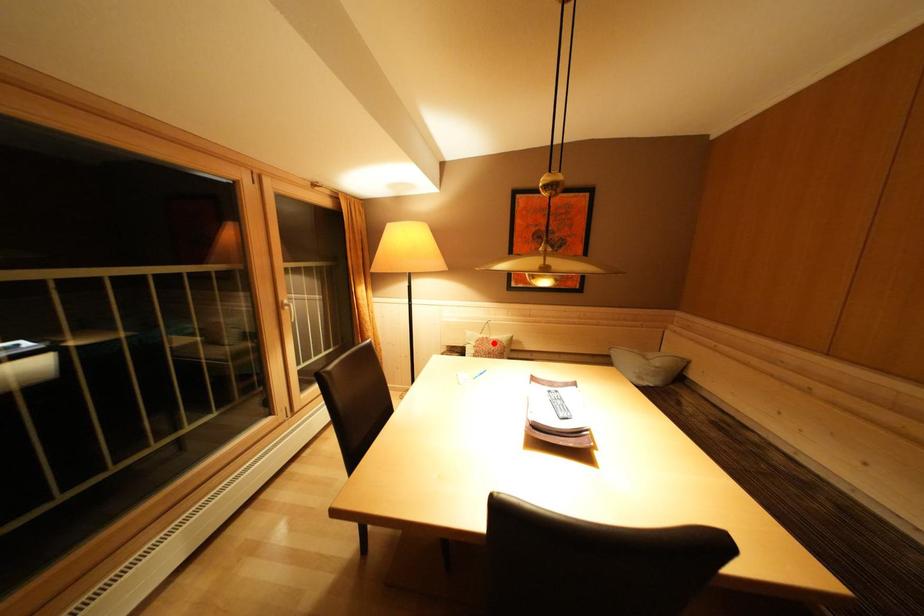
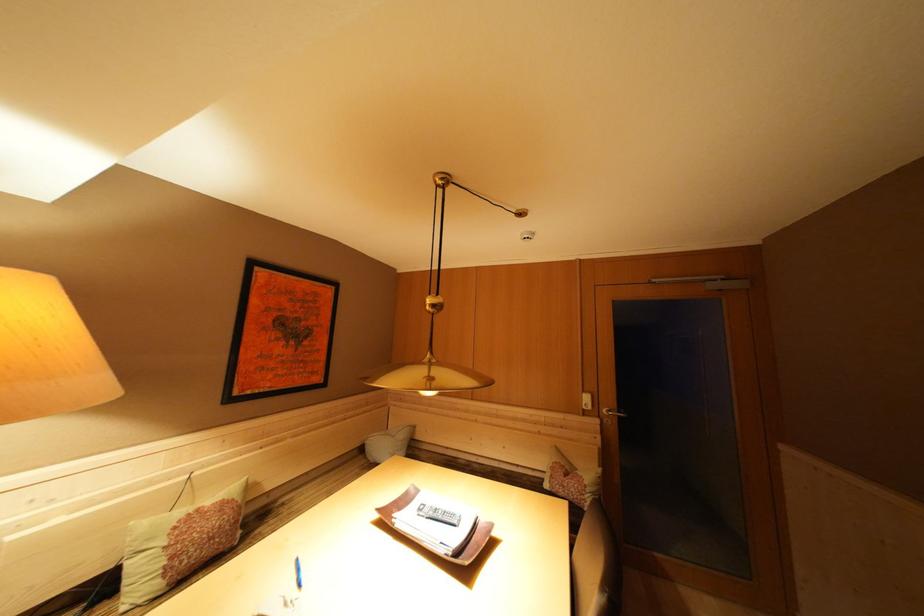
In the second image, find the point that corresponds to the highlighted location in the first image.

(204, 515)